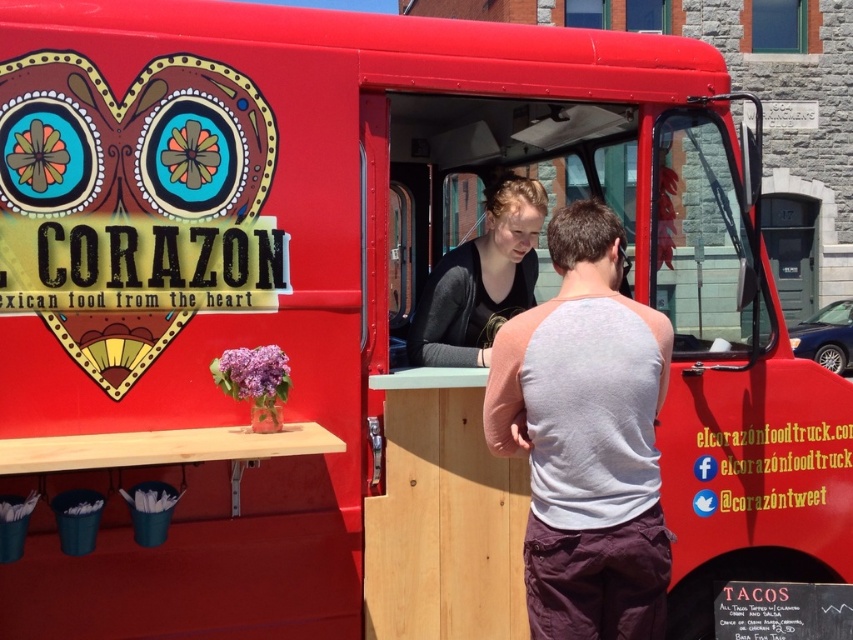
Question: Does gray fabric tank top at center come in front of matte black shirt at center?

Choices:
 (A) no
 (B) yes

Answer: (B)

Question: Which point is closer to the camera taking this photo?

Choices:
 (A) (479, 298)
 (B) (643, 321)

Answer: (B)

Question: Can you confirm if gray fabric tank top at center is wider than matte black shirt at center?

Choices:
 (A) yes
 (B) no

Answer: (A)

Question: Can you confirm if gray fabric tank top at center is positioned to the left of matte black shirt at center?

Choices:
 (A) no
 (B) yes

Answer: (A)